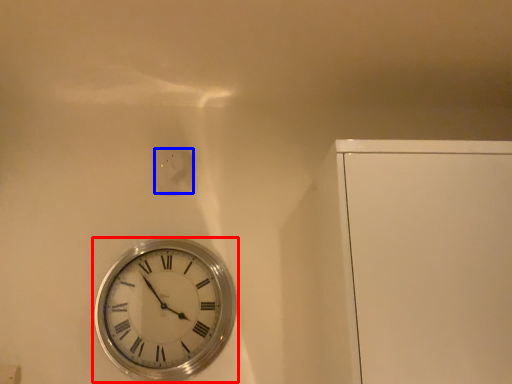
Question: Which of the following is the closest to the observer, wall clock (highlighted by a red box) or electric outlet (highlighted by a blue box)?

Choices:
 (A) wall clock
 (B) electric outlet

Answer: (A)